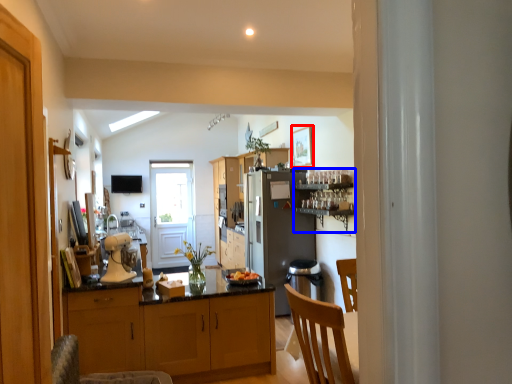
Question: Which object is closer to the camera taking this photo, picture frame (highlighted by a red box) or shelf (highlighted by a blue box)?

Choices:
 (A) picture frame
 (B) shelf

Answer: (B)